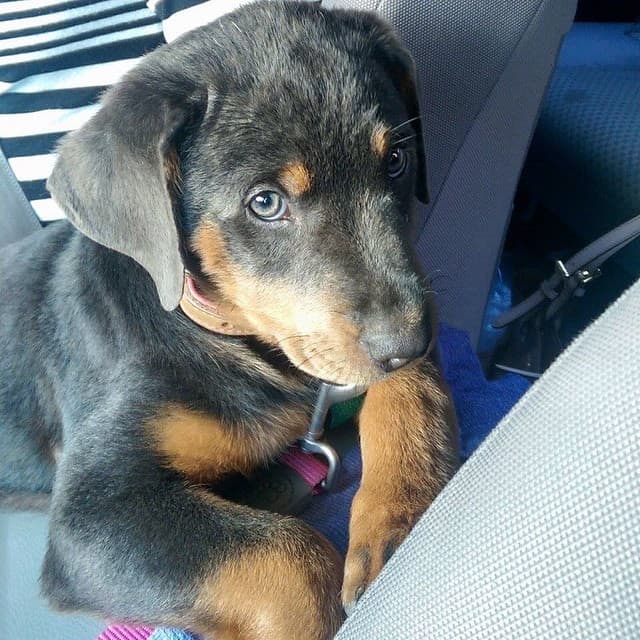
Locate an element on the screen. The height and width of the screenshot is (640, 640). hook is located at coordinates (326, 393), (344, 392), (317, 418), (310, 445).